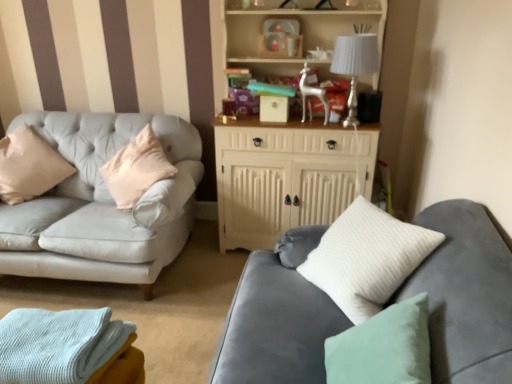
Question: Does point (366, 195) appear closer or farther from the camera than point (342, 41)?

Choices:
 (A) farther
 (B) closer

Answer: (A)

Question: Is white wood cabinet at upper center in front of or behind white fabric lampshade at upper right in the image?

Choices:
 (A) front
 (B) behind

Answer: (A)

Question: Estimate the real-world distances between objects in this image. Which object is farther from the white fabric lampshade at upper right?

Choices:
 (A) white wood cabinet at upper center
 (B) light blue knitted blanket at lower left
 (C) velvet gray couch at lower right

Answer: (B)

Question: Estimate the real-world distances between objects in this image. Which object is farther from the white wood cabinet at upper center?

Choices:
 (A) white fabric lampshade at upper right
 (B) light blue knitted blanket at lower left
 (C) velvet gray couch at lower right

Answer: (B)